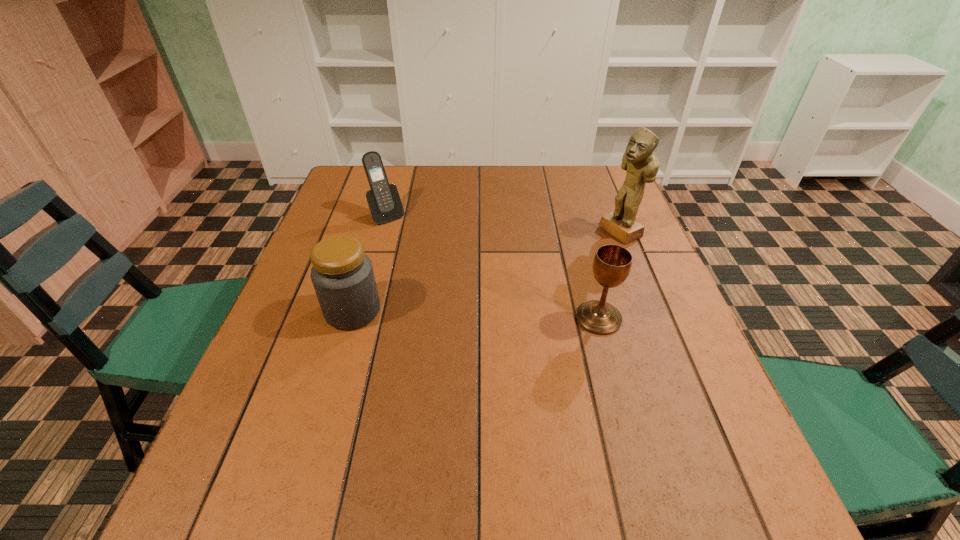
Identify the location of vacant space at the left edge of the desktop. Image resolution: width=960 pixels, height=540 pixels. (281, 399).

At what (x,y) coordinates should I click in order to perform the action: click on free region at the right edge of the desktop. Please return your answer as a coordinate pair (x, y). Looking at the image, I should click on (642, 389).

Identify the location of vacant space at the near left corner of the desktop. (260, 444).

The image size is (960, 540). What are the coordinates of `free space at the far right corner of the desktop` in the screenshot? It's located at (597, 181).

Find the location of a particular element. free space between the cellular telephone and the chalice is located at coordinates point(492,267).

At what (x,y) coordinates should I click in order to perform the action: click on free space between the jar and the chalice. Please return your answer as a coordinate pair (x, y). The height and width of the screenshot is (540, 960). Looking at the image, I should click on (475, 314).

At what (x,y) coordinates should I click in order to perform the action: click on vacant area that lies between the jar and the second object from right to left. Please return your answer as a coordinate pair (x, y). The width and height of the screenshot is (960, 540). Looking at the image, I should click on (475, 314).

Locate an element on the screen. Image resolution: width=960 pixels, height=540 pixels. free space between the second object from right to left and the jar is located at coordinates (475, 314).

This screenshot has height=540, width=960. Find the location of `free space between the cellular telephone and the third object from left to right`. free space between the cellular telephone and the third object from left to right is located at coordinates (492, 267).

Identify the location of vacant area between the second object from right to left and the jar. This screenshot has width=960, height=540. (475, 314).